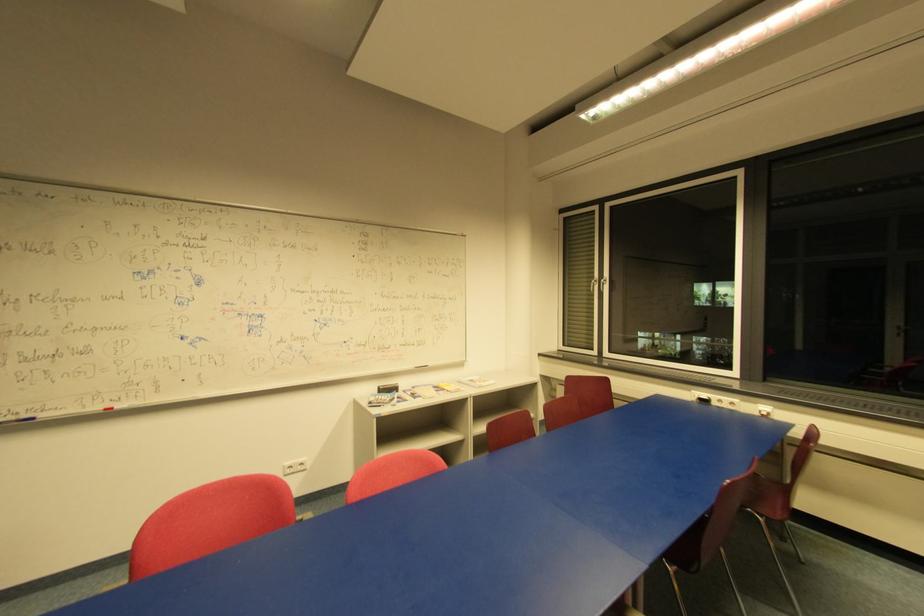
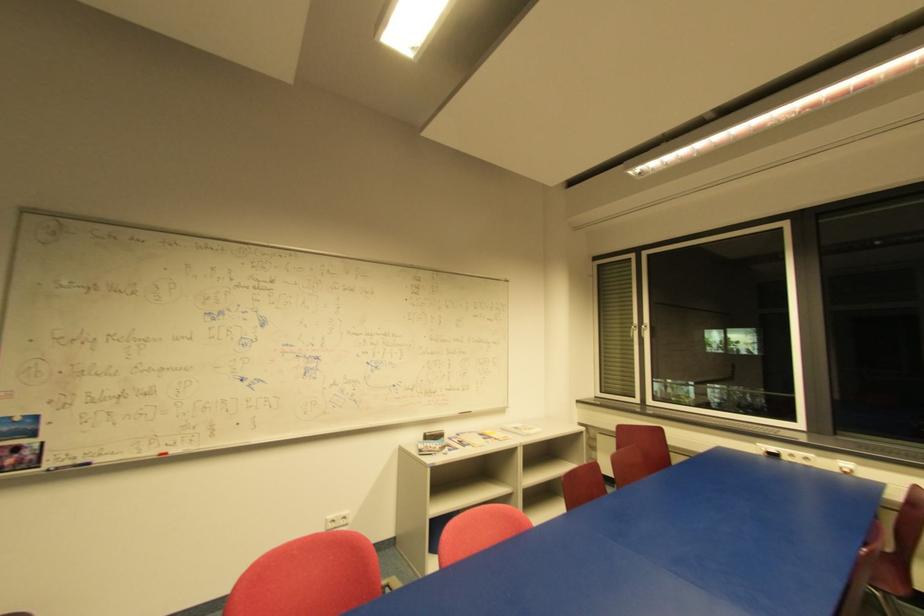
Question: In a continuous first-person perspective shot, in which direction is the camera moving?

Choices:
 (A) Left
 (B) Right
 (C) Forward
 (D) Backward

Answer: (A)